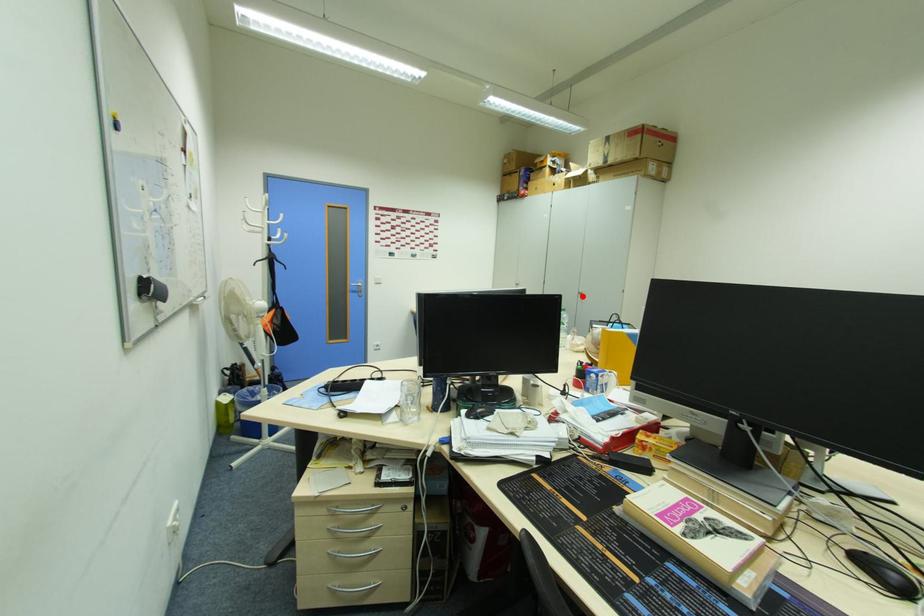
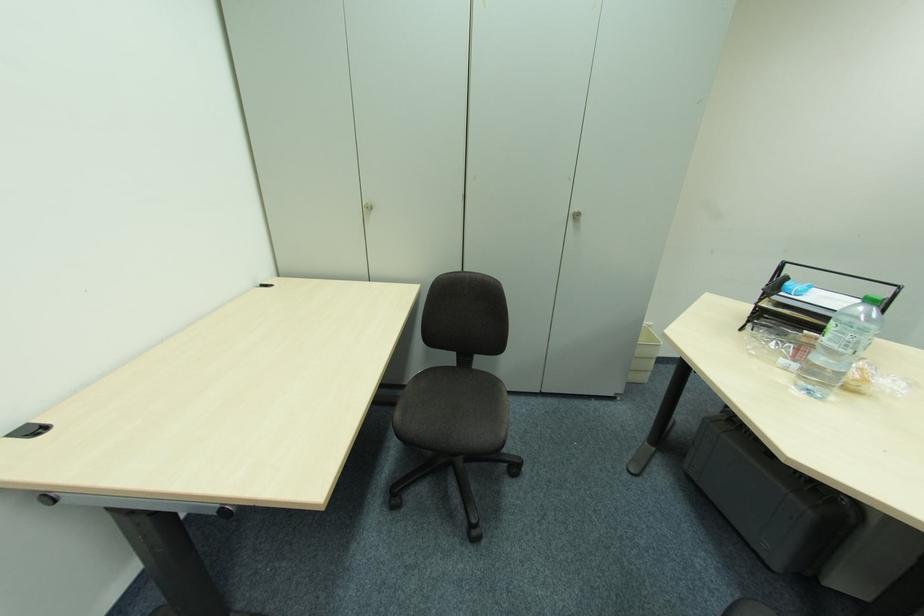
Question: I am providing you with two images of the same scene from different viewpoints. In image1, a red point is highlighted. Considering the same 3D point in image2, which of the following is correct?

Choices:
 (A) It is closer
 (B) It is farther

Answer: (A)